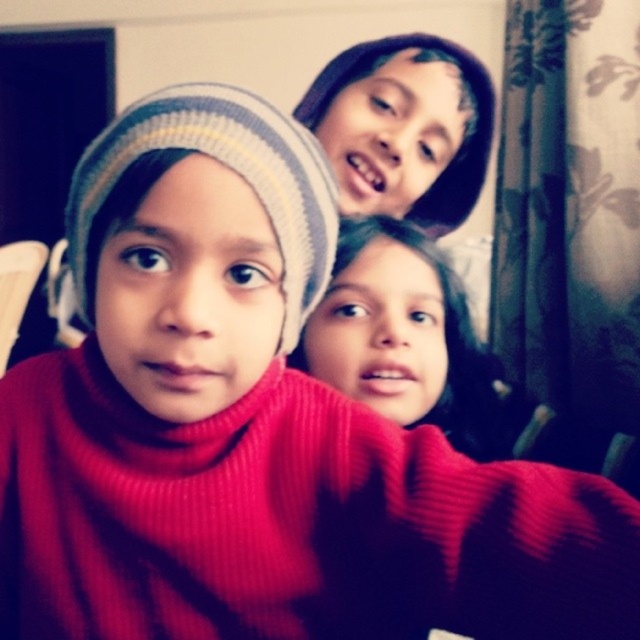
Is striped knit beanie at center taller than matte black beanie at upper center?

In fact, striped knit beanie at center may be shorter than matte black beanie at upper center.

Does striped knit beanie at center have a larger size compared to matte black beanie at upper center?

Incorrect, striped knit beanie at center is not larger than matte black beanie at upper center.

You are a GUI agent. You are given a task and a screenshot of the screen. Output one action in this format:
    pyautogui.click(x=<x>, y=<y>)
    Task: Click on the striped knit beanie at center
    This screenshot has height=640, width=640.
    Given the screenshot: What is the action you would take?
    pyautogui.click(x=228, y=168)